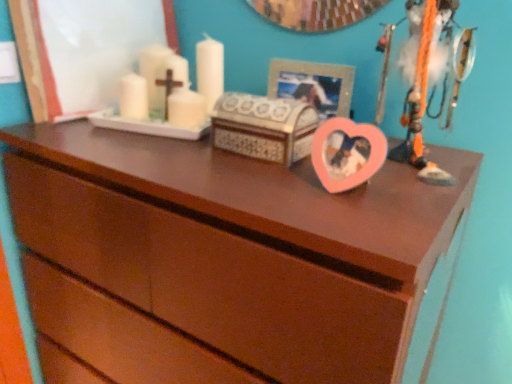
Question: Does brown wood chest of drawers at center have a greater height compared to metallic silver picture frame at upper center?

Choices:
 (A) no
 (B) yes

Answer: (B)

Question: Is brown wood chest of drawers at center positioned before metallic silver picture frame at upper center?

Choices:
 (A) yes
 (B) no

Answer: (A)

Question: Does brown wood chest of drawers at center contain metallic silver picture frame at upper center?

Choices:
 (A) no
 (B) yes

Answer: (A)

Question: Is brown wood chest of drawers at center positioned behind metallic silver picture frame at upper center?

Choices:
 (A) no
 (B) yes

Answer: (A)

Question: From the image's perspective, would you say brown wood chest of drawers at center is shown under metallic silver picture frame at upper center?

Choices:
 (A) yes
 (B) no

Answer: (A)

Question: From a real-world perspective, is brown wood chest of drawers at center physically above metallic silver picture frame at upper center?

Choices:
 (A) no
 (B) yes

Answer: (A)

Question: Does brown wood chest of drawers at center appear on the right side of pink plastic heart at upper right?

Choices:
 (A) yes
 (B) no

Answer: (B)

Question: Does brown wood chest of drawers at center have a greater width compared to pink plastic heart at upper right?

Choices:
 (A) yes
 (B) no

Answer: (A)

Question: From a real-world perspective, is brown wood chest of drawers at center beneath pink plastic heart at upper right?

Choices:
 (A) yes
 (B) no

Answer: (A)

Question: Is brown wood chest of drawers at center positioned far away from pink plastic heart at upper right?

Choices:
 (A) no
 (B) yes

Answer: (A)

Question: From the image's perspective, is brown wood chest of drawers at center located above pink plastic heart at upper right?

Choices:
 (A) no
 (B) yes

Answer: (A)

Question: Is brown wood chest of drawers at center surrounding pink plastic heart at upper right?

Choices:
 (A) yes
 (B) no

Answer: (B)

Question: Would you say pink plastic heart at upper right is outside brown wood chest of drawers at center?

Choices:
 (A) yes
 (B) no

Answer: (A)